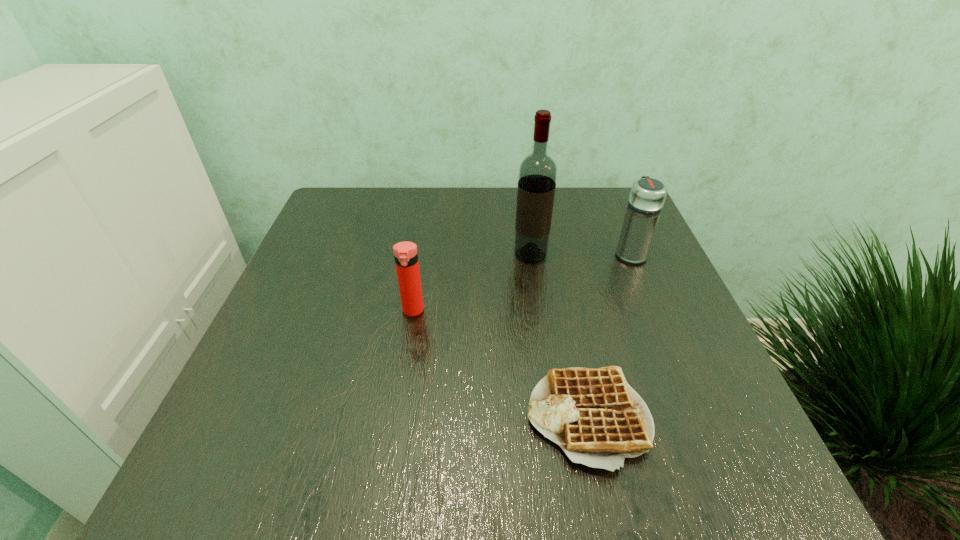
The image size is (960, 540). I want to click on wine bottle, so click(537, 176).

Find the location of a particular element. The height and width of the screenshot is (540, 960). the farther thermos bottle is located at coordinates (647, 196).

I want to click on the right thermos bottle, so click(x=647, y=196).

Find the location of a particular element. The width and height of the screenshot is (960, 540). the second nearest object is located at coordinates (405, 253).

Locate an element on the screen. Image resolution: width=960 pixels, height=540 pixels. the left thermos bottle is located at coordinates click(405, 253).

Find the location of a particular element. waffle is located at coordinates (594, 415).

The height and width of the screenshot is (540, 960). In order to click on the shortest object in this screenshot , I will do `click(594, 415)`.

Locate an element on the screen. The image size is (960, 540). free region located on the right of the wine bottle is located at coordinates (611, 255).

The image size is (960, 540). I want to click on vacant space located 0.090m with a handle on the side of the right thermos bottle, so click(x=617, y=221).

Where is `vacant region located with a handle on the side of the right thermos bottle`? The height and width of the screenshot is (540, 960). vacant region located with a handle on the side of the right thermos bottle is located at coordinates (609, 201).